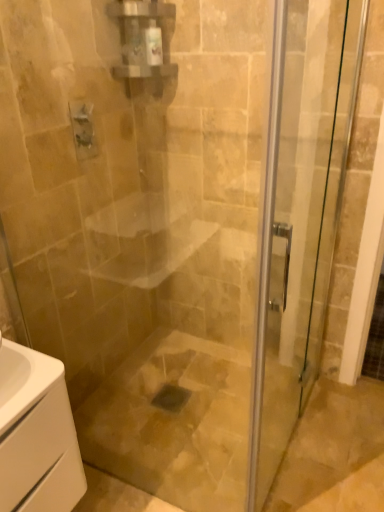
Question: Considering the relative sizes of white glossy cabinet at lower left and transparent glass door at center in the image provided, is white glossy cabinet at lower left wider than transparent glass door at center?

Choices:
 (A) no
 (B) yes

Answer: (B)

Question: Does white glossy cabinet at lower left appear on the left side of transparent glass door at center?

Choices:
 (A) no
 (B) yes

Answer: (B)

Question: Considering the relative sizes of white glossy cabinet at lower left and transparent glass door at center in the image provided, is white glossy cabinet at lower left smaller than transparent glass door at center?

Choices:
 (A) yes
 (B) no

Answer: (A)

Question: Considering the relative sizes of white glossy cabinet at lower left and transparent glass door at center in the image provided, is white glossy cabinet at lower left bigger than transparent glass door at center?

Choices:
 (A) yes
 (B) no

Answer: (B)

Question: From a real-world perspective, is white glossy cabinet at lower left physically above transparent glass door at center?

Choices:
 (A) yes
 (B) no

Answer: (B)

Question: Can you see white glossy cabinet at lower left touching transparent glass door at center?

Choices:
 (A) yes
 (B) no

Answer: (B)

Question: From a real-world perspective, is matte silver faucet at upper left on white glossy cabinet at lower left?

Choices:
 (A) no
 (B) yes

Answer: (B)

Question: Is matte silver faucet at upper left further to the viewer compared to white glossy cabinet at lower left?

Choices:
 (A) no
 (B) yes

Answer: (B)

Question: Can you confirm if matte silver faucet at upper left is thinner than white glossy cabinet at lower left?

Choices:
 (A) no
 (B) yes

Answer: (B)

Question: From a real-world perspective, is matte silver faucet at upper left below white glossy cabinet at lower left?

Choices:
 (A) yes
 (B) no

Answer: (B)

Question: Is matte silver faucet at upper left positioned beyond the bounds of white glossy cabinet at lower left?

Choices:
 (A) yes
 (B) no

Answer: (A)

Question: Considering the relative sizes of matte silver faucet at upper left and white glossy cabinet at lower left in the image provided, is matte silver faucet at upper left shorter than white glossy cabinet at lower left?

Choices:
 (A) yes
 (B) no

Answer: (A)

Question: Is transparent glass door at center positioned far away from white glossy cabinet at lower left?

Choices:
 (A) no
 (B) yes

Answer: (A)